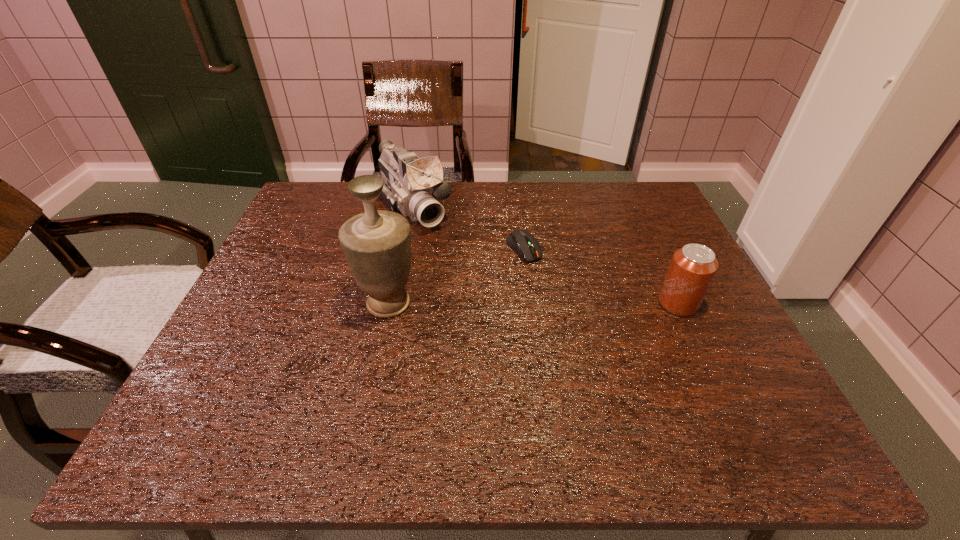
Identify the location of urn. (377, 243).

Find the location of `the rightmost object`. the rightmost object is located at coordinates (693, 267).

Where is `can`? Image resolution: width=960 pixels, height=540 pixels. can is located at coordinates (693, 267).

Identify the location of camcorder. (413, 186).

Where is `the shortest object`? The width and height of the screenshot is (960, 540). the shortest object is located at coordinates (522, 242).

You are a GUI agent. You are given a task and a screenshot of the screen. Output one action in this format:
    pyautogui.click(x=<x>, y=<y>)
    Task: Click on the second object from right to left
    The image size is (960, 540).
    Given the screenshot: What is the action you would take?
    pyautogui.click(x=522, y=242)

Find the location of a particular element. The height and width of the screenshot is (540, 960). free space located on the back of the tallest object is located at coordinates (405, 228).

At what (x,y) coordinates should I click in order to perform the action: click on vacant space located 0.260m on the left of the rightmost object. Please return your answer as a coordinate pair (x, y). The width and height of the screenshot is (960, 540). Looking at the image, I should click on pos(547,303).

Where is `vacant space located 0.240m on the front-facing side of the camcorder`? This screenshot has height=540, width=960. vacant space located 0.240m on the front-facing side of the camcorder is located at coordinates (473, 282).

Identify the location of vacant space located 0.220m on the front-facing side of the camcorder. (469, 278).